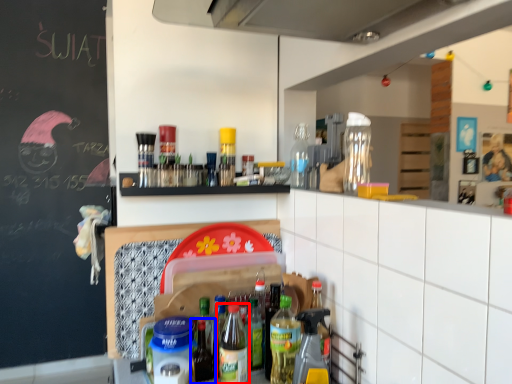
Question: Which object appears closest to the camera in this image, bottle (highlighted by a red box) or bottle (highlighted by a blue box)?

Choices:
 (A) bottle
 (B) bottle

Answer: (A)